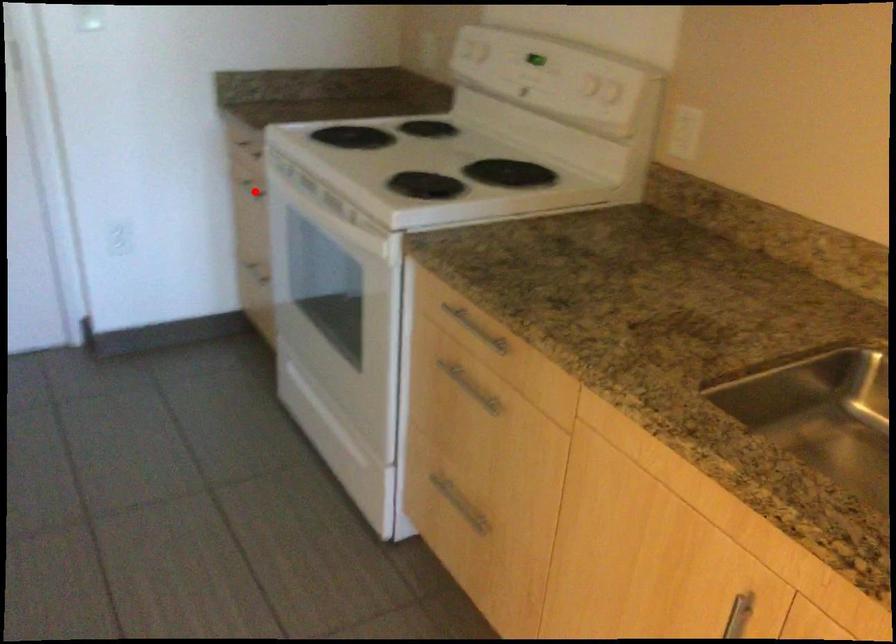
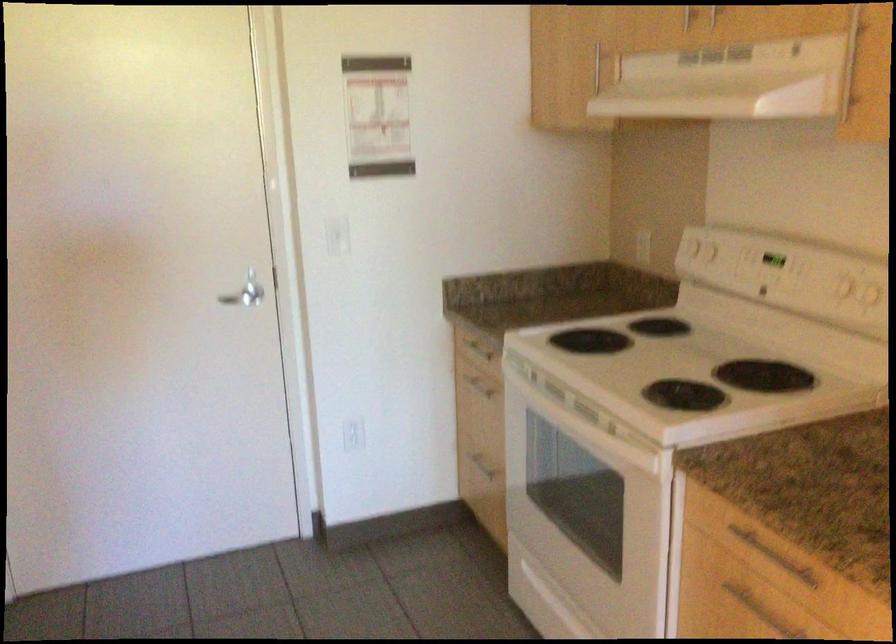
The point at the highlighted location is marked in the first image. Where is the corresponding point in the second image?

(479, 384)